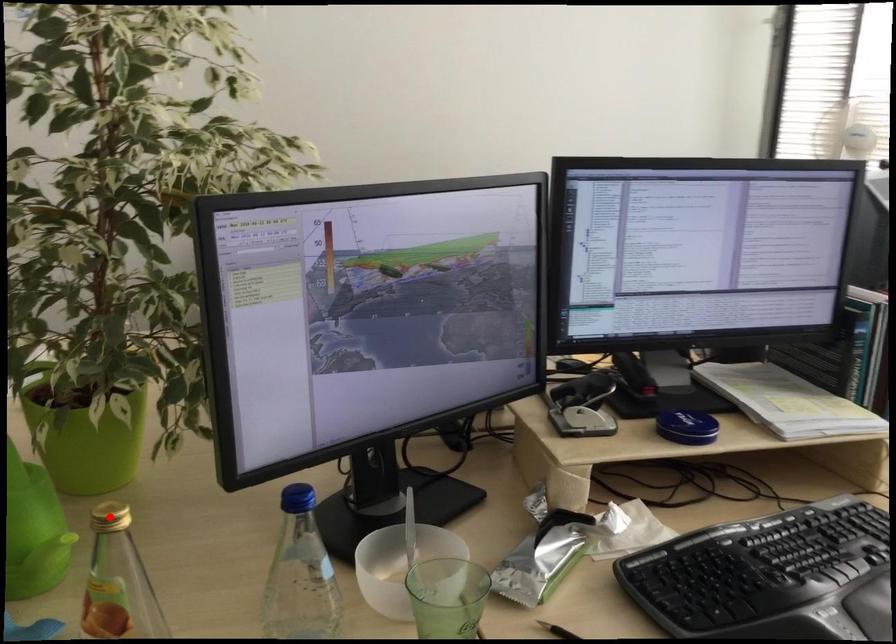
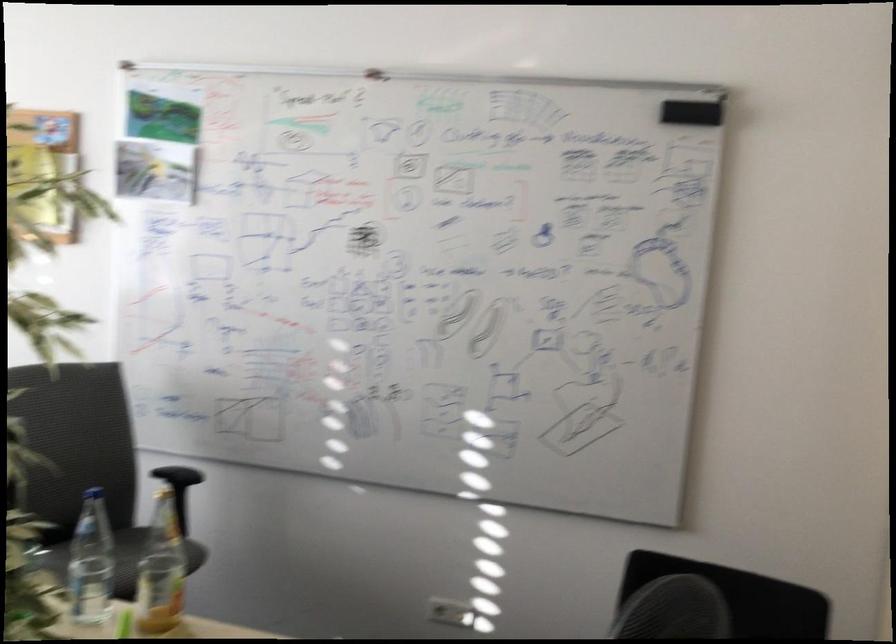
Question: I am providing you with two images of the same scene from different viewpoints. A red point is marked on the first image. Is the red point's position out of view in image 2?

Choices:
 (A) Yes
 (B) No

Answer: (A)